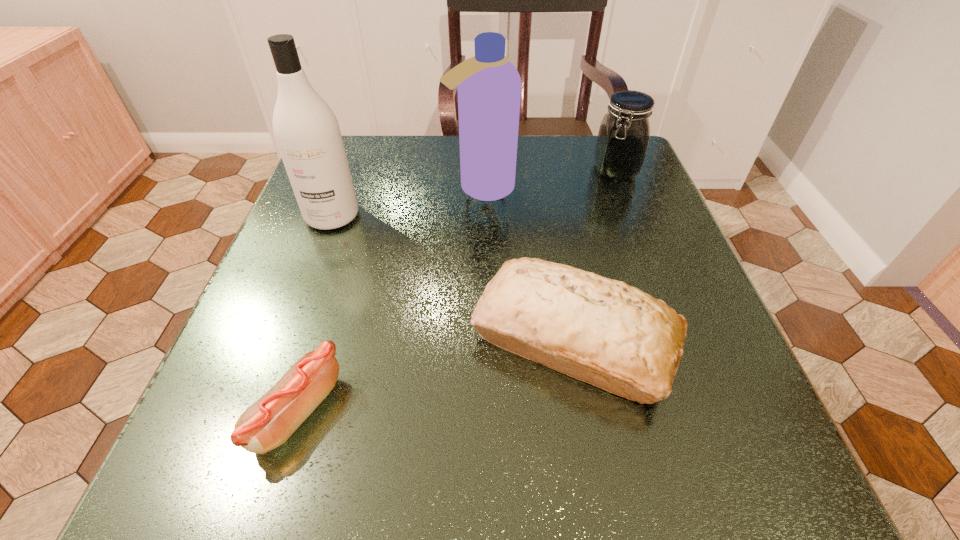
At what (x,y) coordinates should I click in order to perform the action: click on shampoo at the far edge. Please return your answer as a coordinate pair (x, y). The height and width of the screenshot is (540, 960). Looking at the image, I should click on (489, 86).

This screenshot has height=540, width=960. I want to click on jar that is positioned at the far edge, so pos(624,133).

Where is `object present at the near edge`? This screenshot has width=960, height=540. object present at the near edge is located at coordinates (268, 423).

Locate an element on the screen. shampoo that is at the left edge is located at coordinates (306, 130).

In order to click on sausage at the left edge in this screenshot , I will do `click(268, 423)`.

Find the location of `jar that is at the right edge`. jar that is at the right edge is located at coordinates (624, 133).

At what (x,y) coordinates should I click in order to perform the action: click on bread positioned at the right edge. Please return your answer as a coordinate pair (x, y). The height and width of the screenshot is (540, 960). Looking at the image, I should click on coord(614,336).

I want to click on object present at the near left corner, so click(268, 423).

Where is `object located in the far right corner section of the desktop`? This screenshot has width=960, height=540. object located in the far right corner section of the desktop is located at coordinates (624, 133).

I want to click on vacant region at the far edge, so click(x=404, y=187).